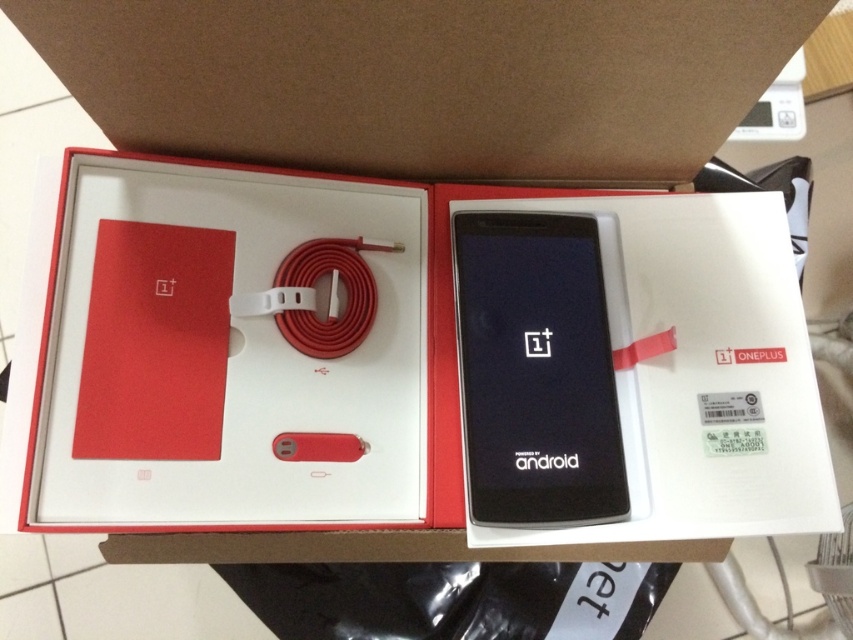
You are trying to fit the black glossy phone at center into the white matte cardboard box at center. Based on their sizes, will the phone fit inside the box?

The white matte cardboard box at center has a larger width than the black glossy phone at center, so the phone should fit inside the box.

You are looking at the open OnePlus box and notice two points marked in the image. The first point is at coordinates point (3, 481) and the second is at point (601, 458). Which point is closer to you as you view the box?

Point (3, 481) is closer to you because it is in front of point (601, 458).

You are organizing items in a box and need to place a new item between the white matte cardboard box at center and the black glossy phone at center. Based on their positions, where should you place the new item?

Since the white matte cardboard box at center is to the left of the black glossy phone at center, you should place the new item between them by positioning it to the right of the white matte cardboard box at center and to the left of the black glossy phone at center.